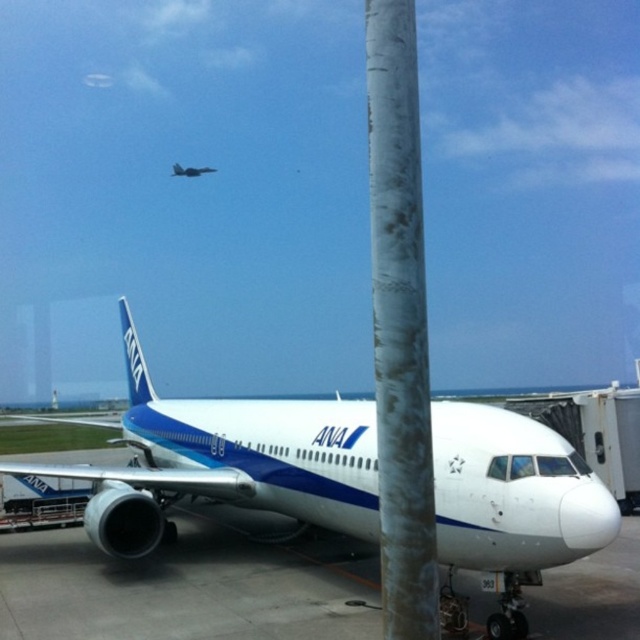
You are a drone operator planning to fly a drone from point A to point B in the airport tarmac scene. The coordinates for point A are point A at (384, 339) and point B are point B at (184, 170). According to the image, will the drone have an unobstructed path between these two points?

Point A at (384, 339) is in front of point B at (184, 170). Since point A is closer to the viewer, the path between them may be obstructed by the prominent pole mentioned in the scene description. Therefore, the drone might not have an unobstructed path between these two points.

You are a pilot preparing to taxi your plane to the runway. You notice the white glossy airplane at center and the gray textured pole at center in your path. Which object is closer to the ground?

The white glossy airplane at center is below the gray textured pole at center, so the white glossy airplane at center is closer to the ground.